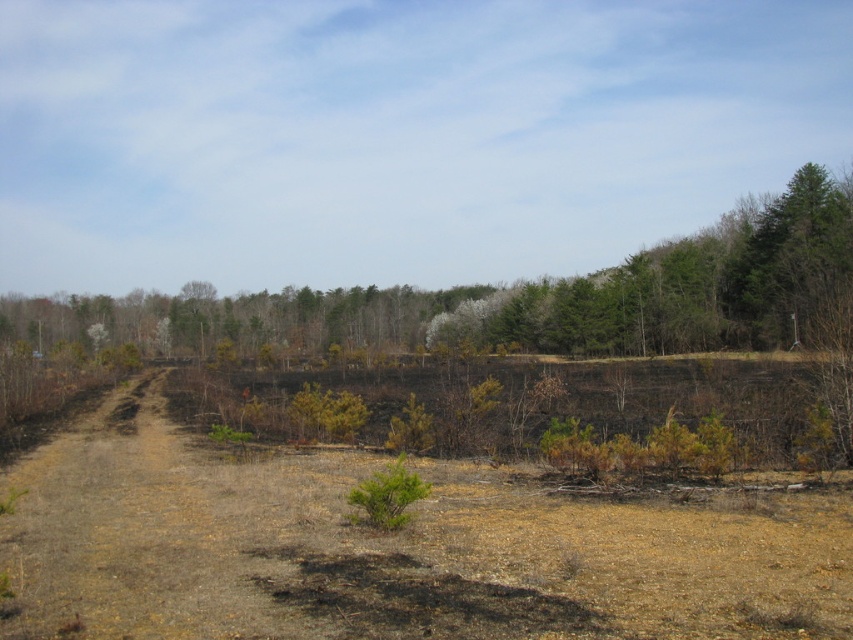
Based on the photo, you are a firefighter assessing the fire risk in the area. You notice the brown dry grass at center and the green matte tree at upper right. Which of these two objects is more likely to contribute to the spread of fire, and why?

The brown dry grass at center is closer to the viewer than the green matte tree at upper right, so it is more likely to contribute to fire spread as dry grass ignites easily and spreads flames quickly compared to the moisture in green vegetation.

You are a firefighter assessing the area after a controlled burn. You see the brown dry grass at center and the green matte tree at upper right. Which object is larger in size?

The brown dry grass at center is smaller than the green matte tree at upper right, so the green matte tree at upper right is larger in size.

You are a firefighter assessing the area after a controlled burn. You notice the brown dry grass at center and the green matte tree at upper right. Which object is located below the other?

The brown dry grass at center is positioned under green matte tree at upper right, so the grass is below the tree.